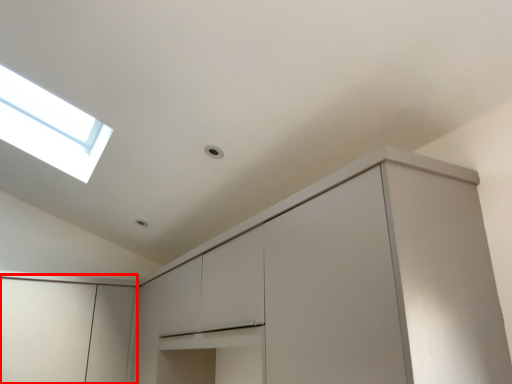
Question: From the image's perspective, what is the correct spatial positioning of cabinetry (annotated by the red box) in reference to cabinetry?

Choices:
 (A) above
 (B) below

Answer: (B)